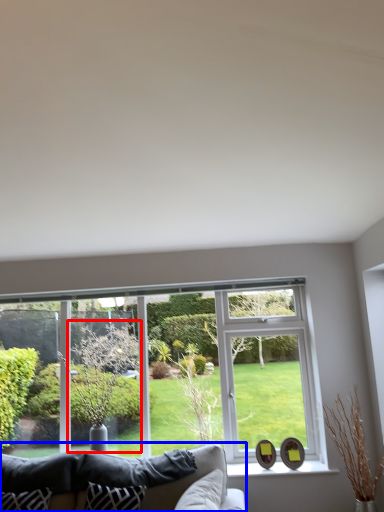
Question: Which object is closer to the camera taking this photo, tree (highlighted by a red box) or studio couch (highlighted by a blue box)?

Choices:
 (A) tree
 (B) studio couch

Answer: (B)